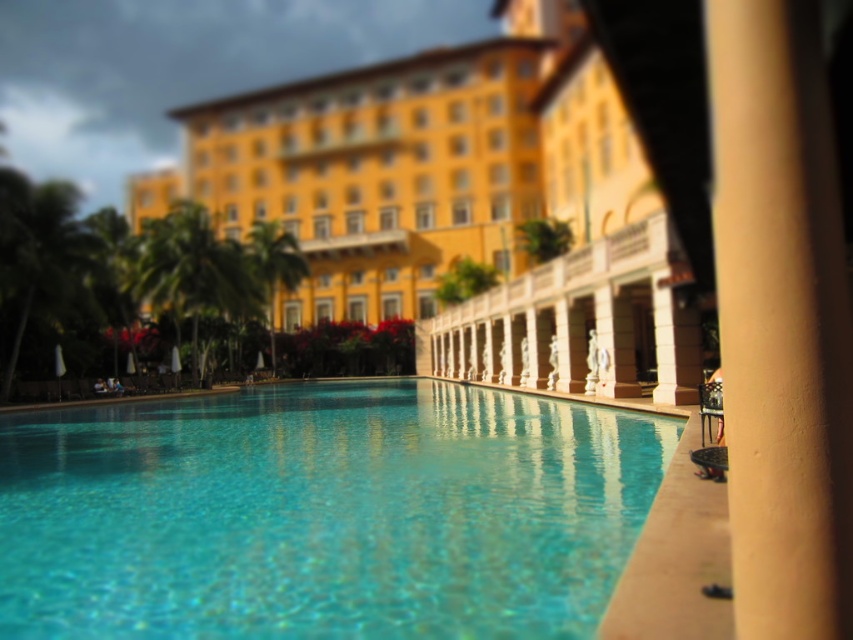
Who is more forward, (814, 556) or (190, 209)?

Positioned in front is point (814, 556).

Between point (828, 525) and point (143, 285), which one is positioned in front?

Positioned in front is point (828, 525).

Locate an element on the screen. This screenshot has height=640, width=853. beige smooth pillar at center is located at coordinates (781, 317).

Looking at this image, does yellow matte building at center appear on the left side of beige smooth pillar at center?

Indeed, yellow matte building at center is positioned on the left side of beige smooth pillar at center.

Does yellow matte building at center lie behind beige smooth pillar at center?

Yes, yellow matte building at center is further from the viewer.

Locate an element on the screen. This screenshot has height=640, width=853. yellow matte building at center is located at coordinates (473, 198).

Which is below, clear glass pool at center or beige smooth pillar at center?

clear glass pool at center

Is point (608, 516) positioned before point (749, 305)?

No, (608, 516) is behind (749, 305).

Identify the location of clear glass pool at center. (322, 513).